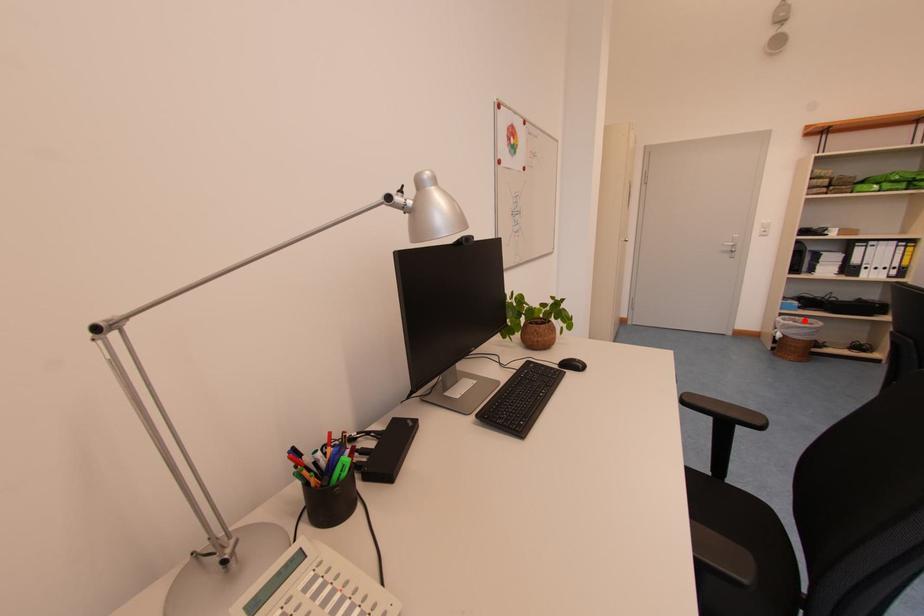
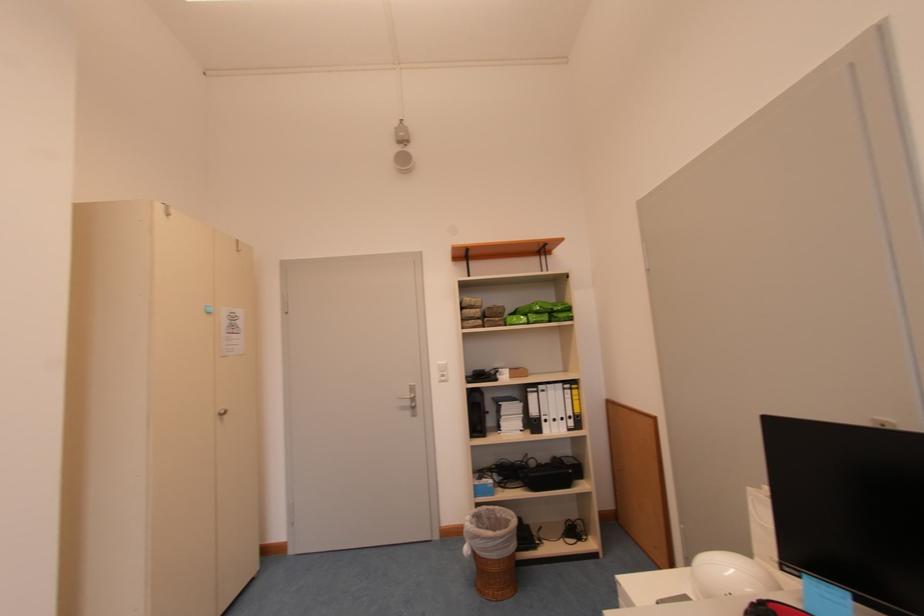
Question: I am providing you with two images of the same scene from different viewpoints. A red point is shown in image1. For the corresponding object point in image2, is it positioned nearer or farther from the camera?

Choices:
 (A) Nearer
 (B) Farther

Answer: (B)